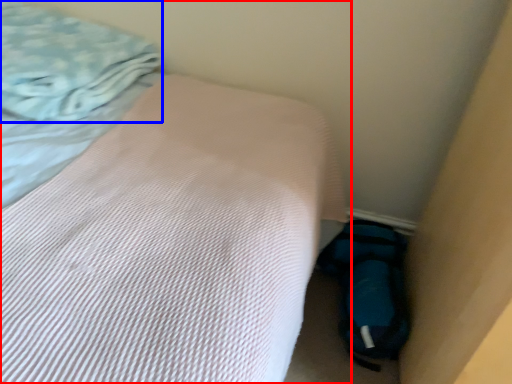
Question: Which object is further to the camera taking this photo, bed (highlighted by a red box) or blanket (highlighted by a blue box)?

Choices:
 (A) bed
 (B) blanket

Answer: (B)